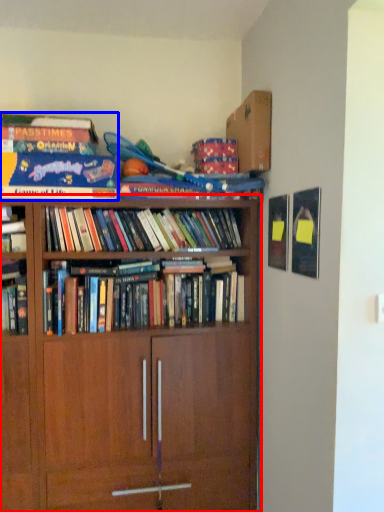
Question: Among these objects, which one is farthest to the camera, bookcase (highlighted by a red box) or book (highlighted by a blue box)?

Choices:
 (A) bookcase
 (B) book

Answer: (B)